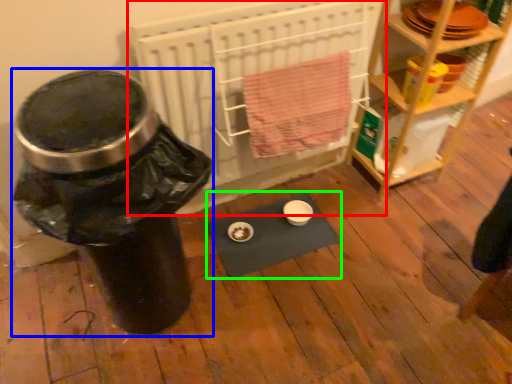
Question: Which object is positioned closest to wide (highlighted by a red box)? Select from water cooler (highlighted by a blue box) and yoga mat (highlighted by a green box).

Choices:
 (A) water cooler
 (B) yoga mat

Answer: (B)